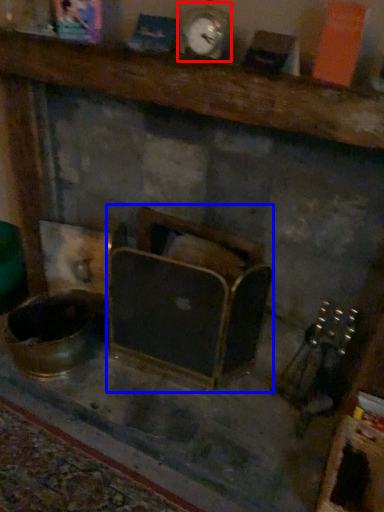
Question: Which point is further to the camera, clock (highlighted by a red box) or furniture (highlighted by a blue box)?

Choices:
 (A) clock
 (B) furniture

Answer: (B)